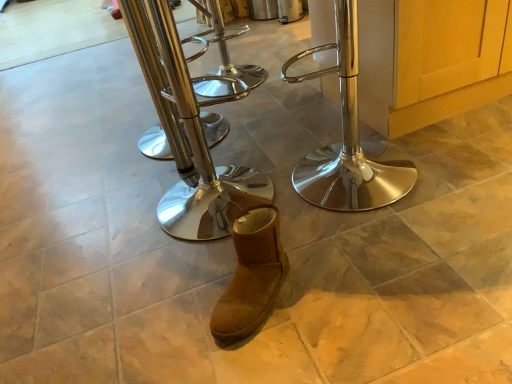
The height and width of the screenshot is (384, 512). What are the coordinates of `free space between polished chrome stool at center, the second step stool viewed from the right, and polished chrome stool at center, which ranks as the 3th step stool in left-to-right order` in the screenshot? It's located at (280, 182).